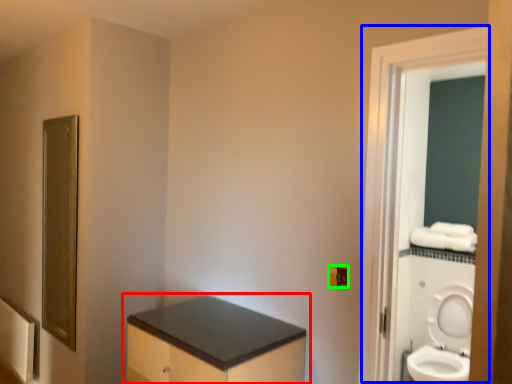
Question: Which object is positioned farthest from bathroom cabinet (highlighted by a red box)? Select from screen door (highlighted by a blue box) and electric outlet (highlighted by a green box).

Choices:
 (A) screen door
 (B) electric outlet

Answer: (A)